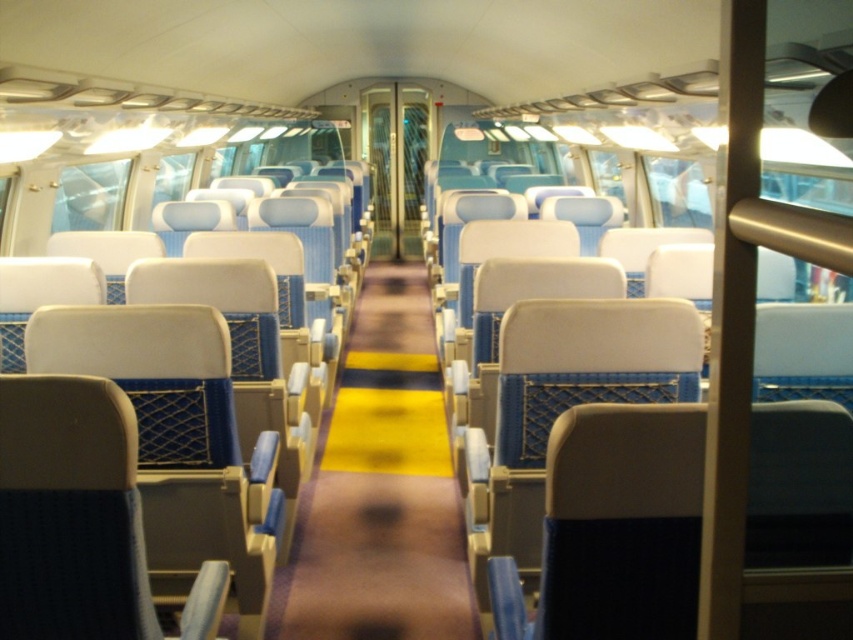
Question: Which point is closer to the camera?

Choices:
 (A) matte blue seat at center
 (B) blue fabric aisle at center

Answer: (A)

Question: Does matte blue seat at center appear on the right side of beige fabric chair at center?

Choices:
 (A) yes
 (B) no

Answer: (B)

Question: Which of these objects is positioned closest to the matte blue seat at center?

Choices:
 (A) blue fabric aisle at center
 (B) blue fabric seat at center
 (C) beige fabric chair at center

Answer: (B)

Question: Is matte blue seat at center further to the viewer compared to beige fabric chair at center?

Choices:
 (A) no
 (B) yes

Answer: (A)

Question: Which object is the farthest from the beige fabric chair at center?

Choices:
 (A) matte blue seat at center
 (B) blue fabric seat at center

Answer: (B)

Question: Can you confirm if beige fabric chair at center is positioned to the left of blue fabric seat at center?

Choices:
 (A) yes
 (B) no

Answer: (B)